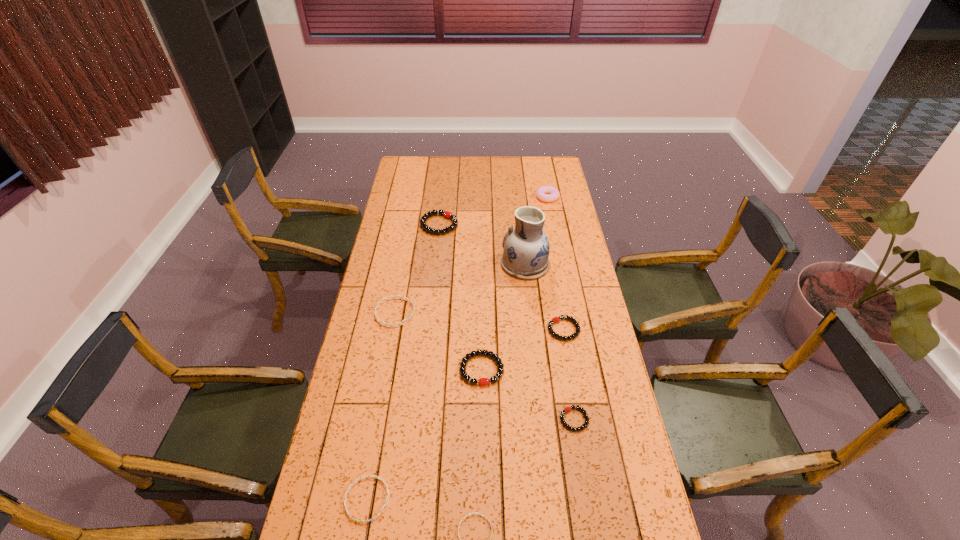
Find the location of a particular element. the second smallest blue bracelet is located at coordinates (365, 476).

The image size is (960, 540). I want to click on the seventh farthest object, so click(567, 409).

The width and height of the screenshot is (960, 540). Find the location of `the fifth farthest bracelet`. the fifth farthest bracelet is located at coordinates (567, 409).

At what (x,y) coordinates should I click in order to perform the action: click on free space located 0.050m on the left of the seventh nearest object. Please return your answer as a coordinate pair (x, y). The height and width of the screenshot is (540, 960). Looking at the image, I should click on (489, 264).

I want to click on vacant space located on the front of the doughnut, so click(x=557, y=246).

Where is `free point located 0.390m on the right of the eighth nearest object`? This screenshot has height=540, width=960. free point located 0.390m on the right of the eighth nearest object is located at coordinates (542, 225).

Image resolution: width=960 pixels, height=540 pixels. Find the location of `free region located 0.050m on the right of the third smallest black bracelet`. free region located 0.050m on the right of the third smallest black bracelet is located at coordinates (519, 369).

You are a GUI agent. You are given a task and a screenshot of the screen. Output one action in this format:
    pyautogui.click(x=<x>, y=<y>)
    Task: Click on the vacant region located on the surface of the farthest blue bracelet showing star-shaped elements
    This screenshot has height=540, width=960.
    Given the screenshot: What is the action you would take?
    pyautogui.click(x=487, y=313)

This screenshot has width=960, height=540. Find the location of `vacant space located on the left of the third nearest black bracelet`. vacant space located on the left of the third nearest black bracelet is located at coordinates (447, 329).

Find the location of a particular element. The width and height of the screenshot is (960, 540). vacant space located on the right of the fifth farthest bracelet is located at coordinates (606, 420).